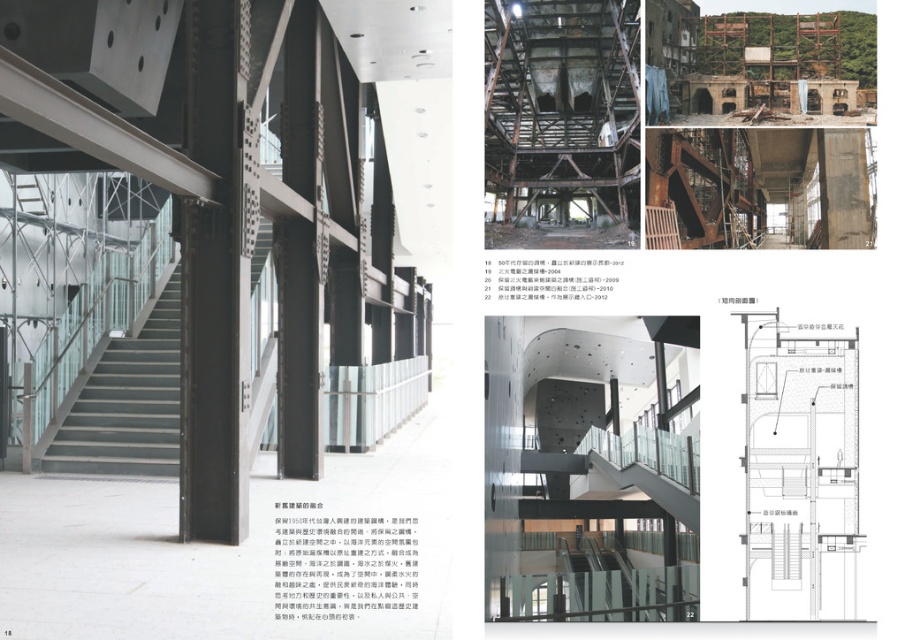
Which of these two, matte gray staircase at center or transparent glass stairs at center, stands taller?

transparent glass stairs at center is taller.

Is point (155, 384) positioned before point (100, 385)?

No, (155, 384) is further to viewer.

Where is `matte gray staircase at center`? Image resolution: width=905 pixels, height=640 pixels. matte gray staircase at center is located at coordinates (127, 403).